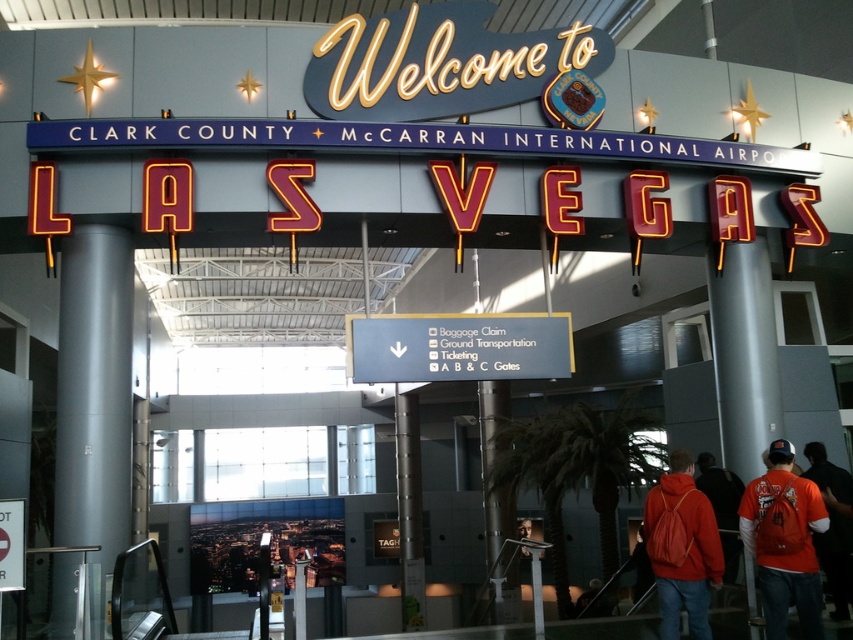
Between point (746, 280) and point (808, 502), which one is positioned in front?

Point (808, 502) is in front.

Can you confirm if silver metallic pillar at right is positioned above orange fabric backpack at lower right?

Indeed, silver metallic pillar at right is positioned over orange fabric backpack at lower right.

Where is `silver metallic pillar at right`? This screenshot has width=853, height=640. silver metallic pillar at right is located at coordinates (744, 355).

Does black plastic sign at center lie in front of metallic gray pillar at center?

Yes, black plastic sign at center is in front of metallic gray pillar at center.

Which is below, black plastic sign at center or metallic gray pillar at center?

metallic gray pillar at center is below.

Find the location of `black plastic sign at center`. black plastic sign at center is located at coordinates (457, 346).

Measure the distance between point (393, 349) and camera.

Point (393, 349) and camera are 8.10 meters apart.

Which is below, black plastic sign at center or orange fabric backpack at lower right?

orange fabric backpack at lower right is below.

Who is more forward, (502, 362) or (804, 596)?

Point (804, 596) is more forward.

Identify the location of black plastic sign at center. This screenshot has height=640, width=853. coord(457,346).